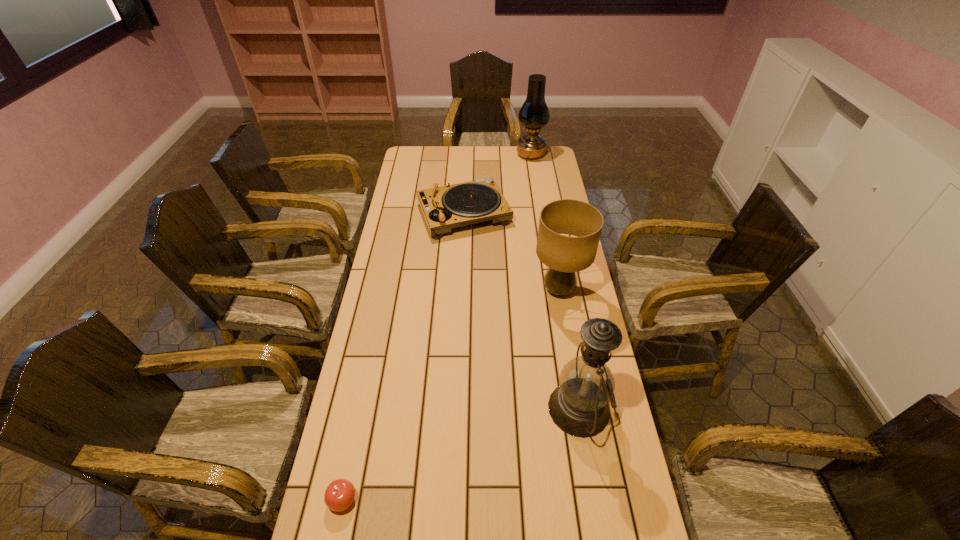
This screenshot has height=540, width=960. I want to click on the farthest object, so click(x=534, y=114).

At what (x,y) coordinates should I click in order to perform the action: click on the nearer oil lamp. Please return your answer as a coordinate pair (x, y). The width and height of the screenshot is (960, 540). Looking at the image, I should click on (579, 406).

This screenshot has width=960, height=540. I want to click on the third nearest object, so click(564, 255).

Find the location of a particular element. The height and width of the screenshot is (540, 960). the second shortest object is located at coordinates (444, 208).

Image resolution: width=960 pixels, height=540 pixels. Identify the location of record player. (444, 208).

The height and width of the screenshot is (540, 960). I want to click on the leftmost object, so click(x=339, y=495).

Identify the location of the shortest object. (339, 495).

The height and width of the screenshot is (540, 960). What are the coordinates of `free space located 0.360m on the front of the farthest object` in the screenshot? It's located at point(539,206).

Locate an element on the screen. The image size is (960, 540). free point located on the left of the second nearest object is located at coordinates (492, 408).

Identify the location of vacant space situated on the back of the lampshade. (547, 226).